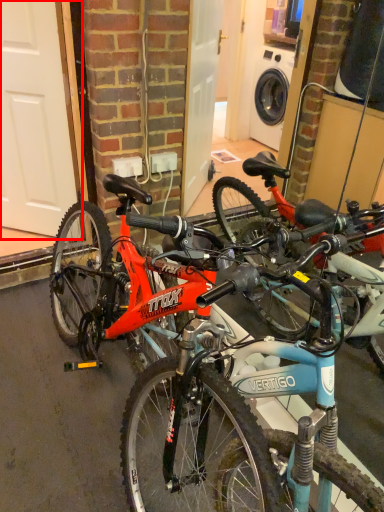
Question: From the image's perspective, where is garage door (annotated by the red box) located in relation to bicycle in the image?

Choices:
 (A) below
 (B) above

Answer: (B)